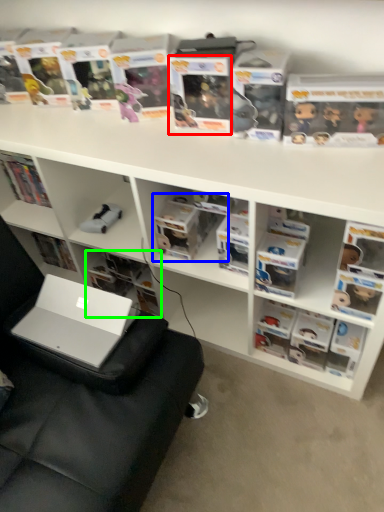
Question: Based on their relative distances, which object is nearer to paperback book (highlighted by a red box)? Choose from book (highlighted by a blue box) and book (highlighted by a green box).

Choices:
 (A) book
 (B) book

Answer: (A)